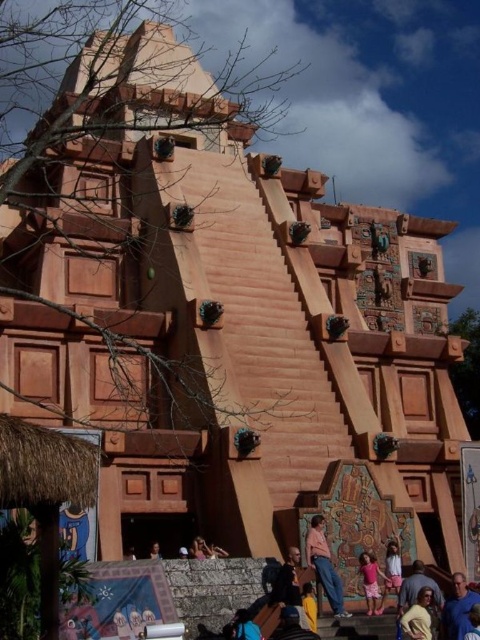
Question: Can you confirm if blue fabric shirt at center is positioned to the left of light brown wooden bench at lower center?

Choices:
 (A) no
 (B) yes

Answer: (A)

Question: Which point is closer to the camera?

Choices:
 (A) (411, 637)
 (B) (372, 608)
 (C) (245, 637)

Answer: (C)

Question: Does pink cotton dress at lower center have a greater width compared to light brown wooden bench at lower center?

Choices:
 (A) yes
 (B) no

Answer: (A)

Question: Is blue fabric shirt at center to the right of light brown leather jacket at lower right from the viewer's perspective?

Choices:
 (A) no
 (B) yes

Answer: (B)

Question: Among these points, which one is nearest to the camera?

Choices:
 (A) (431, 634)
 (B) (324, 582)
 (C) (300, 605)

Answer: (A)

Question: Which point is closer to the camera taking this photo?

Choices:
 (A) (319, 552)
 (B) (236, 621)
 (C) (291, 598)

Answer: (B)